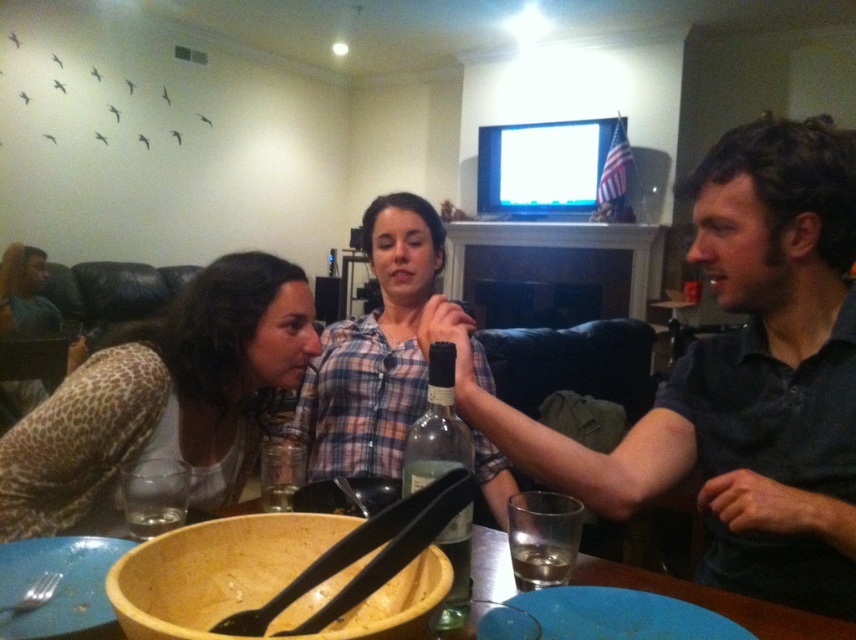
Between point (134, 333) and point (366, 384), which one is positioned behind?

Point (366, 384)

Is giraffe print blouse at left to the left of plaid shirt at center from the viewer's perspective?

Indeed, giraffe print blouse at left is positioned on the left side of plaid shirt at center.

Is point (232, 392) positioned in front of point (308, 449)?

That is True.

This screenshot has height=640, width=856. Find the location of `giraffe print blouse at left`. giraffe print blouse at left is located at coordinates (163, 401).

Is wooden bowl at center positioned at the back of green glass bottle at center?

Yes, it is behind green glass bottle at center.

How far apart are wooden bowl at center and green glass bottle at center?

7.76 inches

Which is behind, point (496, 552) or point (468, 452)?

The point (496, 552) is more distant.

The image size is (856, 640). I want to click on wooden bowl at center, so click(x=714, y=600).

How far apart are giraffe print blouse at left and metallic silver beverage at bowl center?

They are 12.76 inches apart.

Is point (254, 394) more distant than point (129, 513)?

Yes, point (254, 394) is behind point (129, 513).

At what (x,y) coordinates should I click in order to perform the action: click on giraffe print blouse at left. Please return your answer as a coordinate pair (x, y). Looking at the image, I should click on pyautogui.click(x=163, y=401).